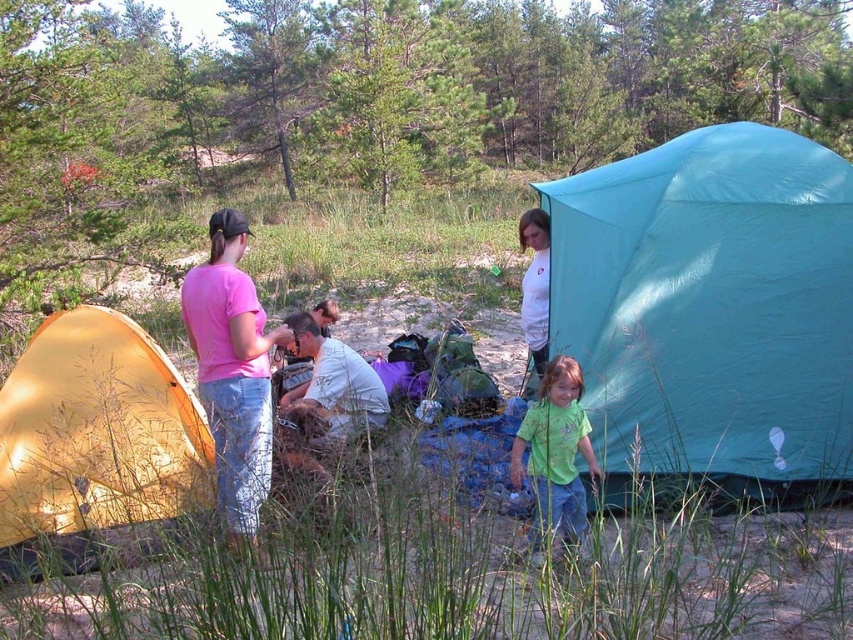
This screenshot has width=853, height=640. What do you see at coordinates (231, 371) in the screenshot?
I see `pink fabric shirt at left` at bounding box center [231, 371].

Is pink fabric shirt at left to the right of white cotton shirt at upper center from the viewer's perspective?

In fact, pink fabric shirt at left is to the left of white cotton shirt at upper center.

Is point (248, 490) farther from viewer compared to point (521, 296)?

No.

Where is `pink fabric shirt at left`? The height and width of the screenshot is (640, 853). pink fabric shirt at left is located at coordinates (231, 371).

Who is shorter, matte yellow tent at left or pink fabric shirt at left?

With less height is matte yellow tent at left.

Is matte yellow tent at left wider than pink fabric shirt at left?

Indeed, matte yellow tent at left has a greater width compared to pink fabric shirt at left.

Which is in front, point (148, 492) or point (242, 314)?

Positioned in front is point (242, 314).

This screenshot has height=640, width=853. Identify the location of matte yellow tent at left. (96, 444).

Between pink fabric shirt at left and green matte shirt at center, which one is positioned higher?

pink fabric shirt at left is higher up.

Identify the location of pink fabric shirt at left. Image resolution: width=853 pixels, height=640 pixels. point(231,371).